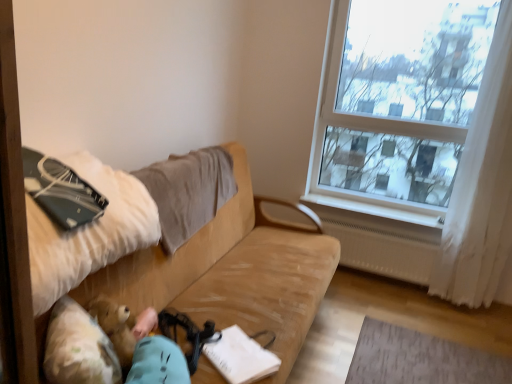
At what (x,y) coordinates should I click in order to perform the action: click on vacant area situated below white sheer curtain at right (from a real-world perspective). Please return your answer as a coordinate pair (x, y). Image resolution: width=512 pixels, height=384 pixels. Looking at the image, I should click on tap(451, 304).